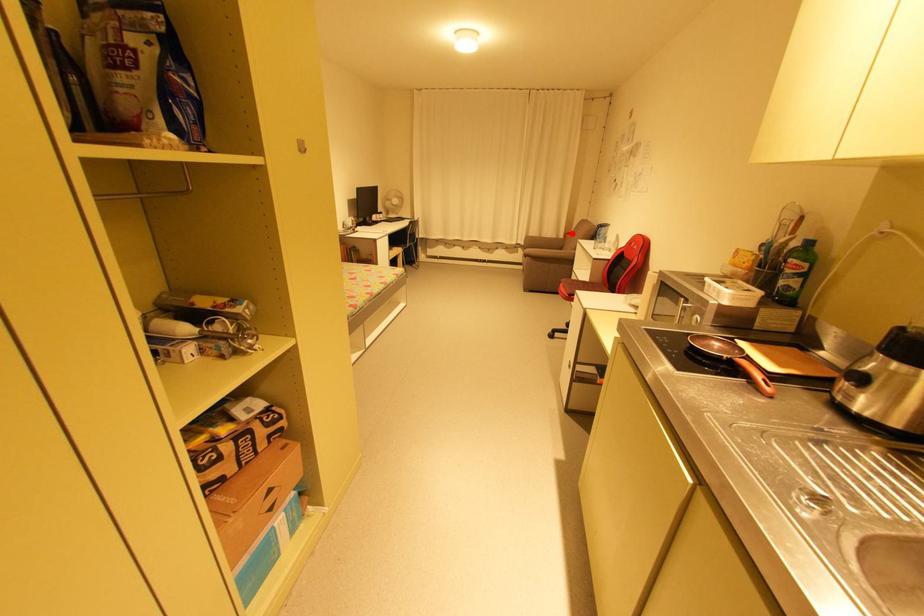
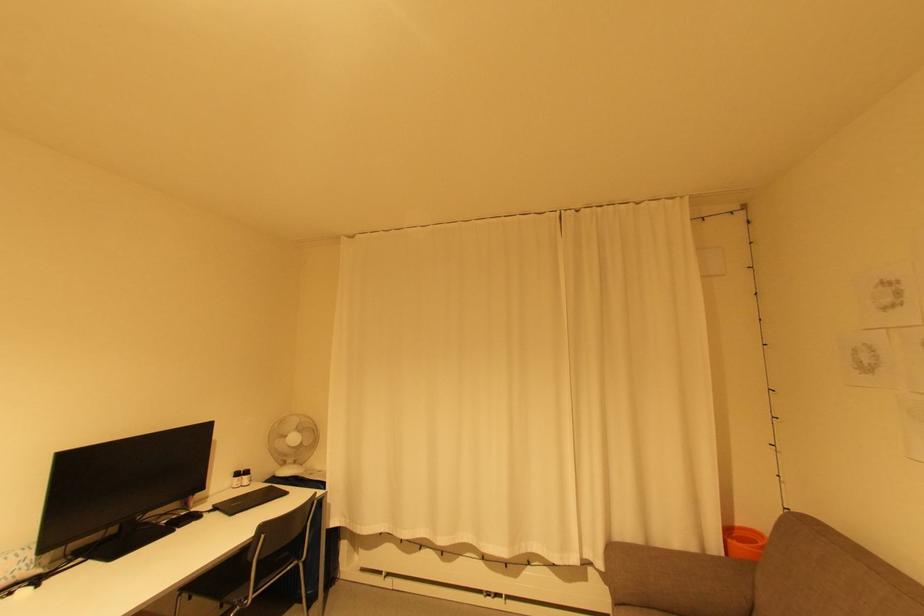
In the second image, find the point that corresponds to the highlighted location in the first image.

(733, 533)